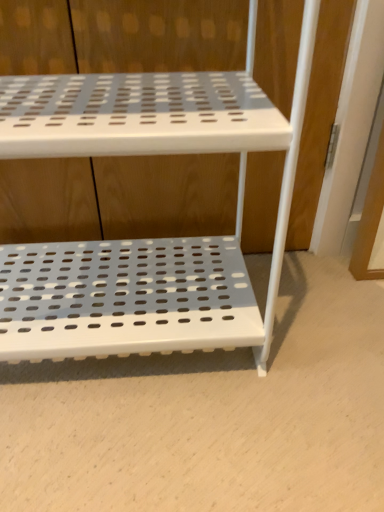
Find the location of `white perforated shelf at center`. white perforated shelf at center is located at coordinates (145, 240).

Describe the element at coordinates (145, 240) in the screenshot. I see `white perforated shelf at center` at that location.

At what (x,y) coordinates should I click in order to perform the action: click on white perforated shelf at center. Please return your answer as a coordinate pair (x, y). This screenshot has width=384, height=512. Looking at the image, I should click on (145, 240).